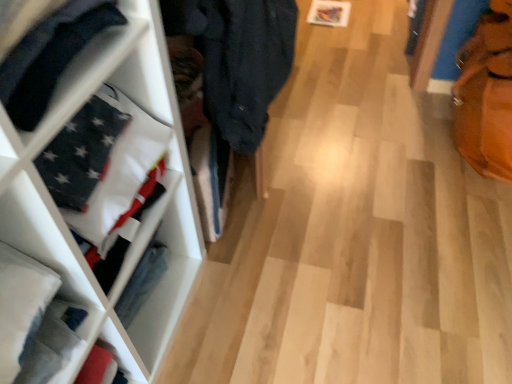
Measure the distance between matte black flag at left and camera.

The depth of matte black flag at left is 18.79 inches.

Locate an element on the screen. matte black flag at left is located at coordinates (50, 57).

Image resolution: width=512 pixels, height=384 pixels. I want to click on white fabric at left, so click(x=96, y=214).

Describe the element at coordinates (96, 214) in the screenshot. I see `white fabric at left` at that location.

You are a GUI agent. You are given a task and a screenshot of the screen. Output one action in this format:
    pyautogui.click(x=<x>, y=<y>)
    Task: Click on the leather textured tote bag at right
    This screenshot has width=512, height=384.
    Given the screenshot: What is the action you would take?
    (486, 94)

You are a GUI agent. You are given a task and a screenshot of the screen. Output one action in this format:
    pyautogui.click(x=<x>, y=<y>)
    Task: Click on the matte black flag at left
    The width and height of the screenshot is (512, 384).
    Given the screenshot: What is the action you would take?
    pyautogui.click(x=50, y=57)

Are white fabric at left and leather textured tote bag at right making contact?

They are not placed beside each other.

Which is more to the right, white fabric at left or leather textured tote bag at right?

leather textured tote bag at right is more to the right.

Considering the sizes of objects white fabric at left and leather textured tote bag at right in the image provided, who is taller, white fabric at left or leather textured tote bag at right?

With more height is leather textured tote bag at right.

Which of these two, white fabric at left or leather textured tote bag at right, is smaller?

With smaller size is white fabric at left.

Considering the relative sizes of leather textured tote bag at right and white fabric at left in the image provided, is leather textured tote bag at right thinner than white fabric at left?

In fact, leather textured tote bag at right might be wider than white fabric at left.

Is leather textured tote bag at right positioned with its back to white fabric at left?

That's not correct — leather textured tote bag at right is not looking away from white fabric at left.

Considering the points (477, 31) and (89, 83), which point is in front, point (477, 31) or point (89, 83)?

The point (89, 83) is closer to the camera.

Based on the photo, is white fabric at left aimed at matte black flag at left?

No, white fabric at left is not aimed at matte black flag at left.

Is point (96, 211) closer to viewer compared to point (81, 31)?

No, it is not.

Measure the distance between white fabric at left and matte black flag at left.

white fabric at left is 11.04 inches away from matte black flag at left.

Is white fabric at left situated inside matte black flag at left or outside?

white fabric at left is outside matte black flag at left.

In the scene shown: Do you think matte black flag at left is within white fabric at left, or outside of it?

matte black flag at left is spatially situated outside white fabric at left.

Is matte black flag at left with white fabric at left?

matte black flag at left and white fabric at left are clearly separated.

Locate an element on the screen. shelf that is under the matte black flag at left (from a real-world perspective) is located at coordinates (96, 214).

How far apart are matte black flag at left and leather textured tote bag at right?

matte black flag at left is 3.91 feet from leather textured tote bag at right.

Is matte black flag at left positioned with its back to leather textured tote bag at right?

matte black flag at left does not have its back to leather textured tote bag at right.

Is point (121, 18) in front of point (505, 100)?

Yes, it is in front of point (505, 100).

Is matte black flag at left smaller than leather textured tote bag at right?

Indeed, matte black flag at left has a smaller size compared to leather textured tote bag at right.

Is there a large distance between leather textured tote bag at right and matte black flag at left?

leather textured tote bag at right is far away from matte black flag at left.

Which object is positioned more to the left, leather textured tote bag at right or matte black flag at left?

matte black flag at left.

Could you tell me if leather textured tote bag at right is facing matte black flag at left?

No, leather textured tote bag at right is not turned towards matte black flag at left.

What's the angular difference between leather textured tote bag at right and matte black flag at left's facing directions?

leather textured tote bag at right and matte black flag at left are facing 91.2 degrees away from each other.

This screenshot has width=512, height=384. What are the coordinates of `shelf located in front of the leather textured tote bag at right` in the screenshot? It's located at (96, 214).

Where is `tote bag on the right of the white fabric at left`? tote bag on the right of the white fabric at left is located at coordinates (486, 94).

Which object lies nearer to the anchor point matte black flag at left, leather textured tote bag at right or white fabric at left?

Among the two, white fabric at left is located nearer to matte black flag at left.

When comparing their distances from white fabric at left, does matte black flag at left or leather textured tote bag at right seem closer?

matte black flag at left is positioned closer to the anchor white fabric at left.

Based on their spatial positions, is white fabric at left or leather textured tote bag at right further from matte black flag at left?

leather textured tote bag at right is further to matte black flag at left.

Estimate the real-world distances between objects in this image. Which object is closer to leather textured tote bag at right, matte black flag at left or white fabric at left?

white fabric at left is closer to leather textured tote bag at right.

Based on their spatial positions, is white fabric at left or matte black flag at left closer to leather textured tote bag at right?

white fabric at left is closer to leather textured tote bag at right.

Estimate the real-world distances between objects in this image. Which object is closer to white fabric at left, leather textured tote bag at right or matte black flag at left?

Among the two, matte black flag at left is located nearer to white fabric at left.

Find the location of a particular element. shelf between matte black flag at left and leather textured tote bag at right is located at coordinates (96, 214).